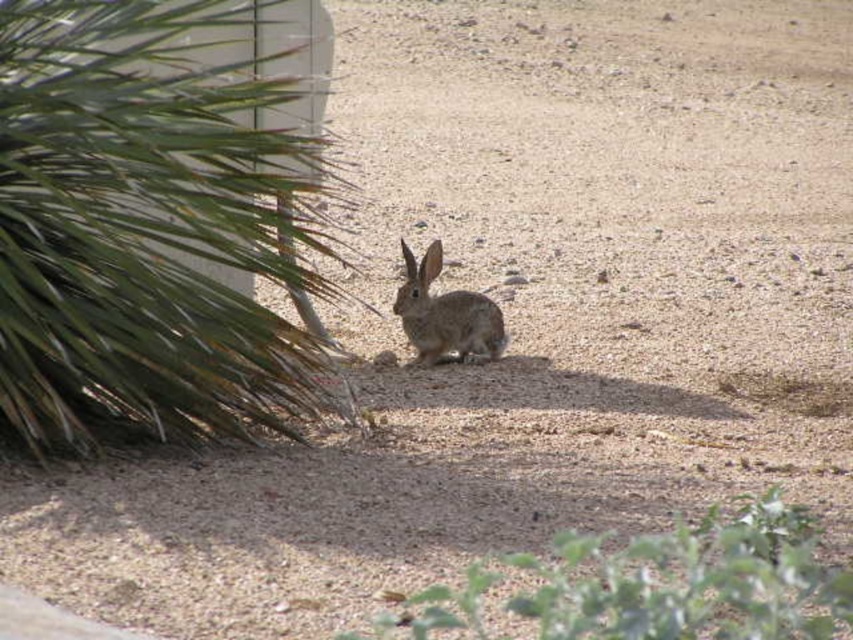
Can you confirm if green leafy plant at left is shorter than furry brown rabbit at center?

In fact, green leafy plant at left may be taller than furry brown rabbit at center.

Which is in front, point (248, 152) or point (486, 321)?

Point (248, 152) is in front.

Identify the location of green leafy plant at left. This screenshot has height=640, width=853. (160, 220).

In the scene shown: Between green leafy plant at left and green leafy plant at lower right, which one appears on the left side from the viewer's perspective?

Positioned to the left is green leafy plant at left.

Is green leafy plant at left shorter than green leafy plant at lower right?

No, green leafy plant at left is not shorter than green leafy plant at lower right.

Is point (254, 374) less distant than point (775, 522)?

That is False.

You are a GUI agent. You are given a task and a screenshot of the screen. Output one action in this format:
    pyautogui.click(x=<x>, y=<y>)
    Task: Click on the green leafy plant at left
    
    Given the screenshot: What is the action you would take?
    pyautogui.click(x=160, y=220)

Does green leafy plant at lower right have a lesser height compared to furry brown rabbit at center?

Yes, green leafy plant at lower right is shorter than furry brown rabbit at center.

Which of these two, green leafy plant at lower right or furry brown rabbit at center, stands shorter?

With less height is green leafy plant at lower right.

What do you see at coordinates (648, 586) in the screenshot? I see `green leafy plant at lower right` at bounding box center [648, 586].

Identify the location of green leafy plant at lower right. (648, 586).